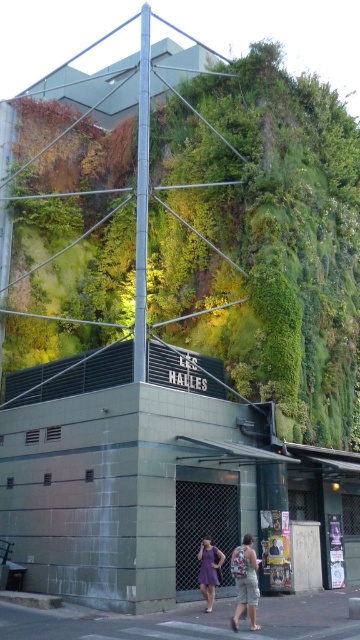
Question: Which point is closer to the camera taking this photo?

Choices:
 (A) (216, 557)
 (B) (241, 586)

Answer: (B)

Question: Which point is closer to the camera?

Choices:
 (A) purple fabric dress at center
 (B) light purple fabric dress at center

Answer: (B)

Question: Which of the following is the farthest from the observer?

Choices:
 (A) (245, 592)
 (B) (74, 163)

Answer: (B)

Question: Is green mossy wall at upper center wider than light purple fabric dress at center?

Choices:
 (A) no
 (B) yes

Answer: (B)

Question: Can you confirm if green mossy wall at upper center is thinner than purple fabric dress at center?

Choices:
 (A) yes
 (B) no

Answer: (B)

Question: Can you confirm if green mossy wall at upper center is wider than light purple fabric dress at center?

Choices:
 (A) yes
 (B) no

Answer: (A)